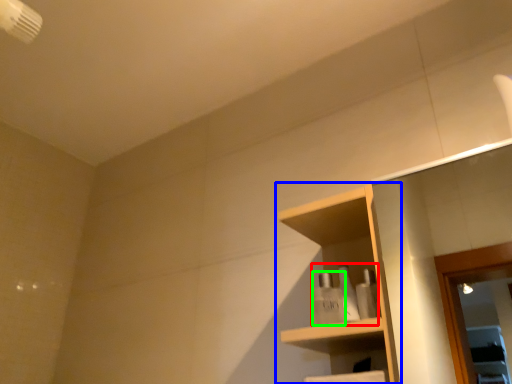
Question: Which object is positioned closest to toiletry (highlighted by a red box)? Select from shelf (highlighted by a blue box) and toiletry (highlighted by a green box).

Choices:
 (A) shelf
 (B) toiletry

Answer: (B)